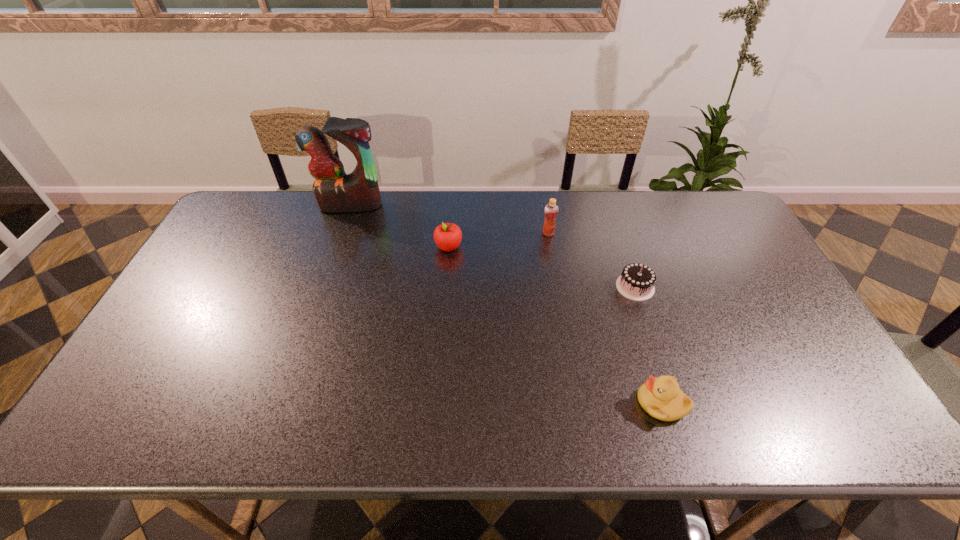
In the image, there is a desktop. Identify the location of vacant space at the left edge. (155, 338).

I want to click on vacant space at the right edge of the desktop, so click(771, 323).

Find the location of a particular element. The height and width of the screenshot is (540, 960). free space at the far left corner of the desktop is located at coordinates (242, 230).

Where is `blank region between the tallest object and the nearest object`? The width and height of the screenshot is (960, 540). blank region between the tallest object and the nearest object is located at coordinates (506, 304).

Identify the location of vacant point located between the second farthest object and the tallest object. coord(449,219).

The image size is (960, 540). What are the coordinates of `free space between the fourth shortest object and the leftmost object` in the screenshot? It's located at (449, 219).

Find the location of a particular element. This screenshot has height=540, width=960. blank region between the parrot and the second farthest object is located at coordinates (449, 219).

You are a GUI agent. You are given a task and a screenshot of the screen. Output one action in this format:
    pyautogui.click(x=<x>, y=<y>)
    Task: Click on the vacant area between the second tallest object and the third farthest object
    
    Given the screenshot: What is the action you would take?
    click(498, 240)

Locate an element on the screen. The height and width of the screenshot is (540, 960). empty space between the third nearest object and the third object from right to left is located at coordinates (498, 240).

This screenshot has width=960, height=540. In order to click on free spot between the fourth shortest object and the parrot in this screenshot , I will do `click(449, 219)`.